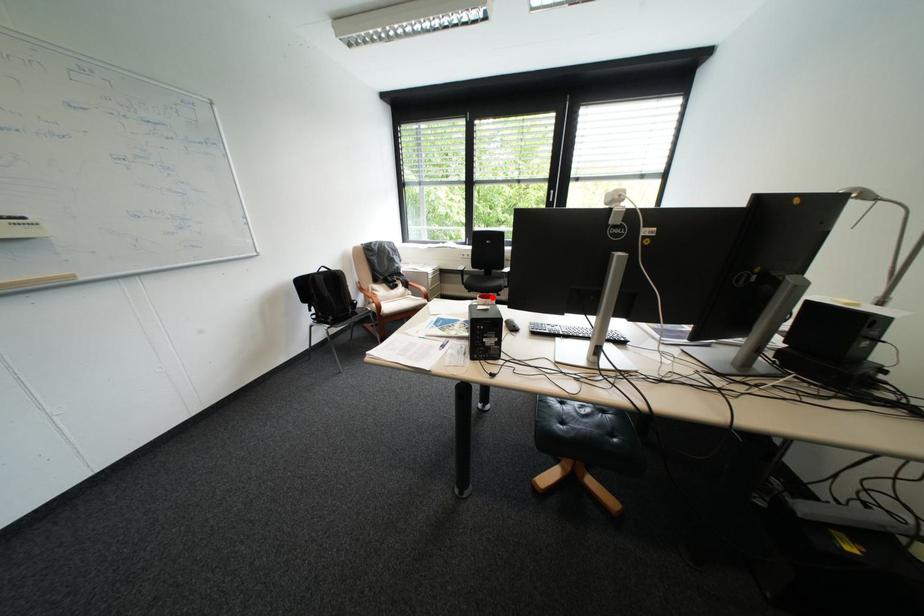
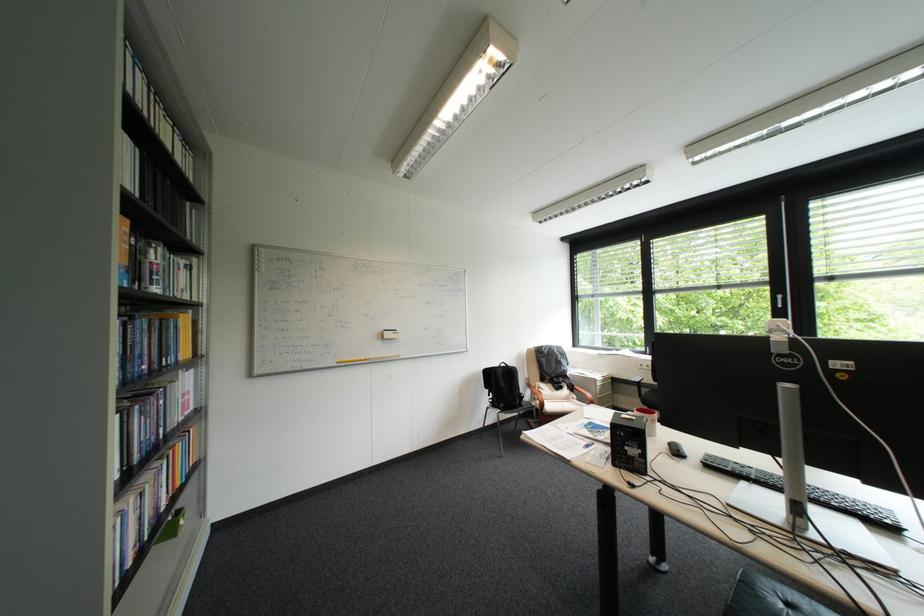
Question: I am providing you with two images of the same scene from different viewpoints. A red point is shown in image1. For the corresponding object point in image2, is it positioned nearer or farther from the camera?

Choices:
 (A) Nearer
 (B) Farther

Answer: (A)